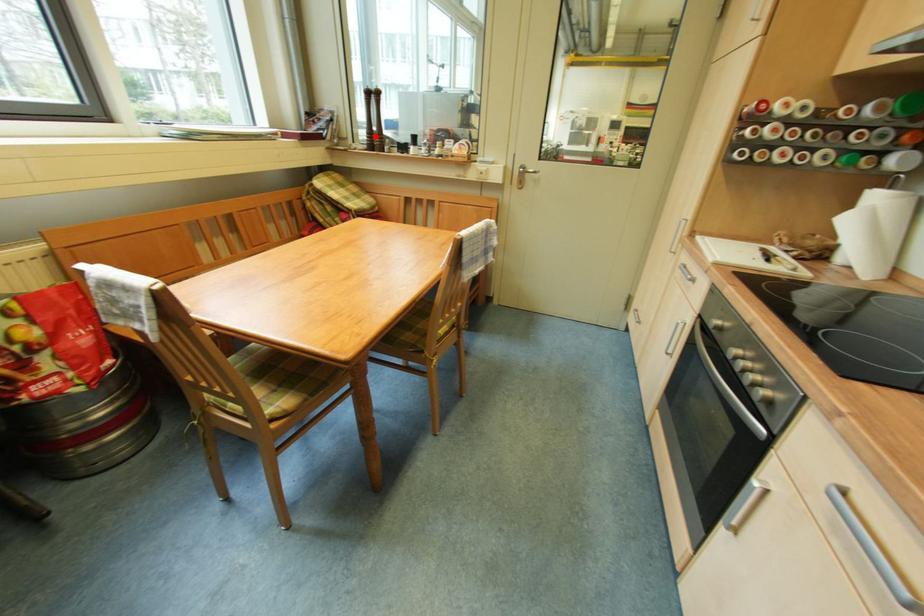
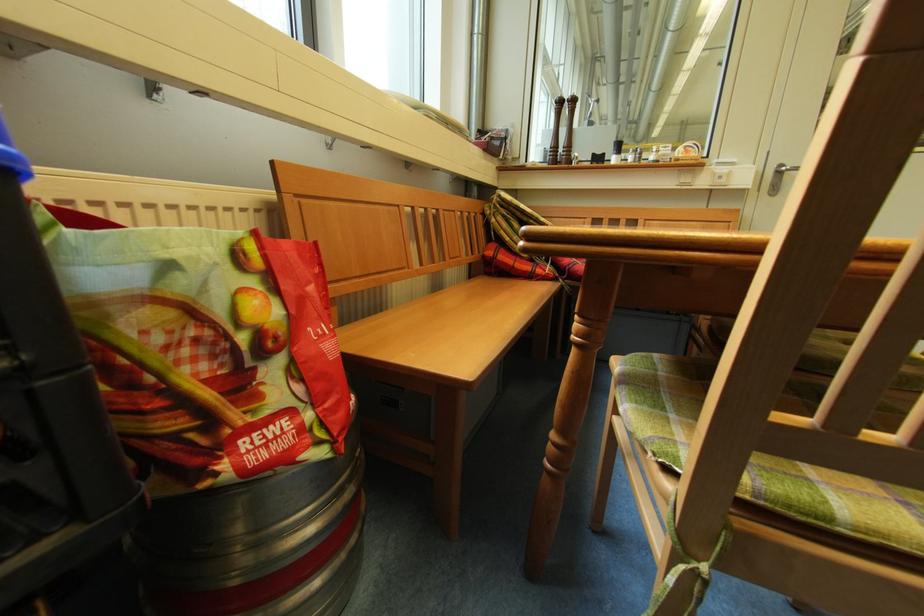
Find the pixel in the second image that matches the highlighted location in the first image.

(558, 151)